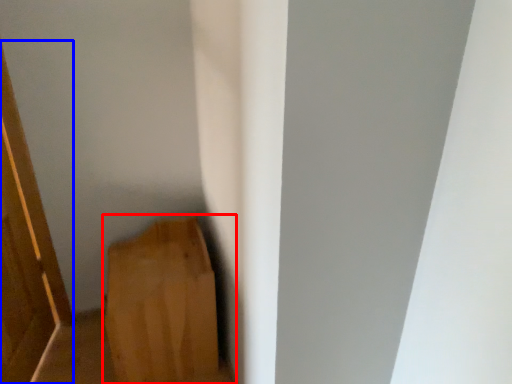
Question: Which object is further to the camera taking this photo, furniture (highlighted by a red box) or door (highlighted by a blue box)?

Choices:
 (A) furniture
 (B) door

Answer: (A)